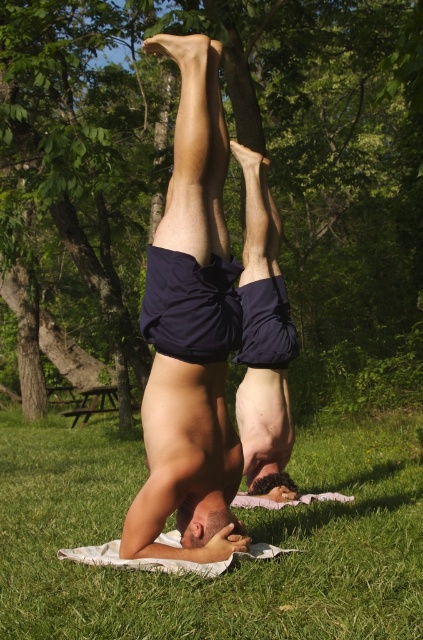
Can you confirm if green grass at lower center is positioned to the right of matte blue shorts at center?

Yes, green grass at lower center is to the right of matte blue shorts at center.

Between point (154, 604) and point (164, 205), which one is positioned in front?

Point (154, 604) is in front.

Locate an element on the screen. This screenshot has height=640, width=423. green grass at lower center is located at coordinates (238, 563).

Is green leafy tree at upper center positioned at the back of green grass at lower center?

Yes, it is behind green grass at lower center.

Which is more to the left, green leafy tree at upper center or green grass at lower center?

green leafy tree at upper center

Who is more distant from viewer, [65,262] or [227,576]?

Point [65,262]

You are a GUI agent. You are given a task and a screenshot of the screen. Output one action in this format:
    pyautogui.click(x=<x>, y=<y>)
    Task: Click on the green leafy tree at upper center
    The width and height of the screenshot is (423, 640).
    Given the screenshot: What is the action you would take?
    pyautogui.click(x=239, y=141)

Which is more to the right, green leafy tree at upper center or matte blue shorts at center?

matte blue shorts at center

Looking at this image, who is more forward, (397, 92) or (175, 38)?

Point (175, 38) is more forward.

Is point (71, 244) closer to viewer compared to point (184, 97)?

No, (71, 244) is further to viewer.

Find the location of a particular element. The width and height of the screenshot is (423, 640). green leafy tree at upper center is located at coordinates (239, 141).